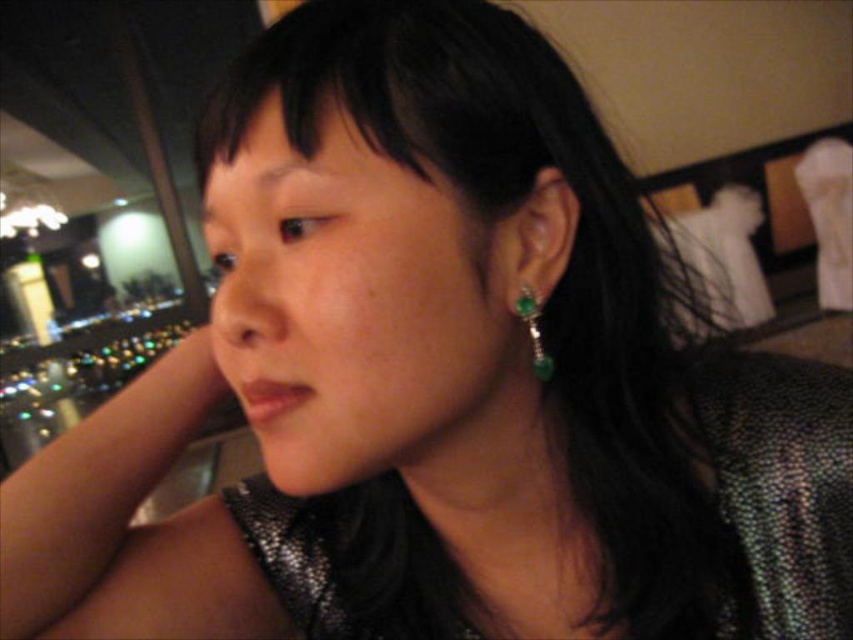
What are the coordinates of the black shiny hair at center?

The black shiny hair at center is located at coordinates point (554, 282).